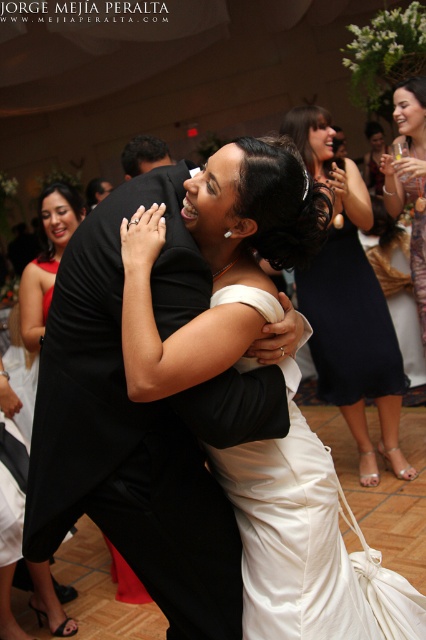
Between matte gold necklace at upper right and black satin suit at upper left, which one is positioned lower?

matte gold necklace at upper right is below.

Is matte gold necklace at upper right bigger than black satin suit at upper left?

Yes, matte gold necklace at upper right is bigger than black satin suit at upper left.

Does point (405, 132) come closer to viewer compared to point (124, 163)?

No, (405, 132) is further to viewer.

At what (x,y) coordinates should I click in order to perform the action: click on matte gold necklace at upper right. Please return your answer as a coordinate pair (x, y). The width and height of the screenshot is (426, 640). Looking at the image, I should click on (409, 177).

Who is lower down, black satin suit at upper left or black satin suit at center?

black satin suit at upper left is lower down.

Is point (146, 134) farther from viewer compared to point (103, 192)?

That is False.

Where is `black satin suit at upper left`? black satin suit at upper left is located at coordinates (143, 154).

Does satin black dress at upper right have a larger size compared to black satin suit at center?

Correct, satin black dress at upper right is larger in size than black satin suit at center.

Does satin black dress at upper right have a lesser height compared to black satin suit at center?

Incorrect, satin black dress at upper right's height does not fall short of black satin suit at center's.

Identify the location of satin black dress at upper right. Image resolution: width=426 pixels, height=640 pixels. (348, 305).

Image resolution: width=426 pixels, height=640 pixels. I want to click on satin black dress at upper right, so click(348, 305).